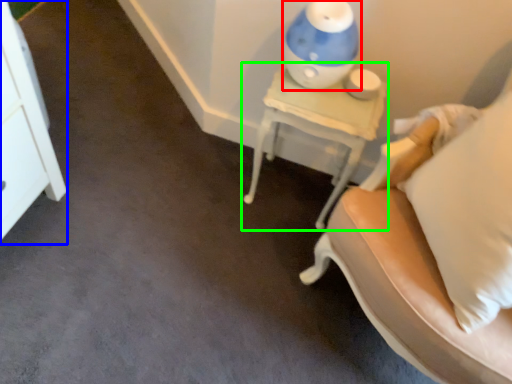
Question: Estimate the real-world distances between objects in this image. Which object is closer to table lamp (highlighted by a red box), dresser (highlighted by a blue box) or nightstand (highlighted by a green box)?

Choices:
 (A) dresser
 (B) nightstand

Answer: (B)